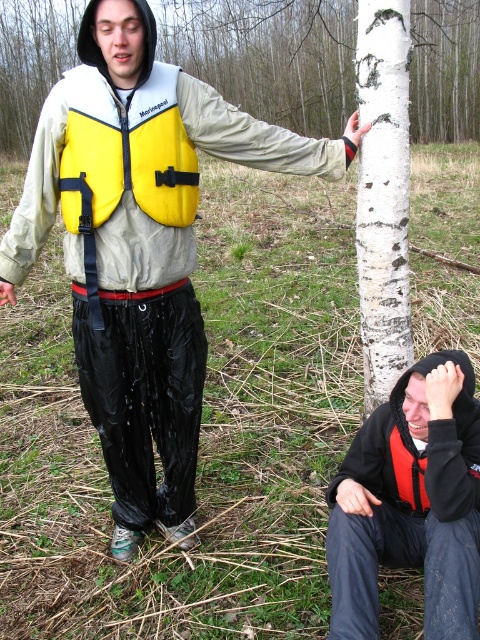
Is point (76, 28) positioned in front of point (384, 396)?

No.

What do you see at coordinates (268, 54) in the screenshot? I see `white smooth tree at center` at bounding box center [268, 54].

Measure the distance between point [440,49] and camera.

Point [440,49] is 29.47 meters from camera.

At what (x,y) coordinates should I click in order to perform the action: click on white smooth tree at center. Please return your answer as a coordinate pair (x, y). The image size is (480, 640). Looking at the image, I should click on (268, 54).

Based on the photo, does white bark tree at center appear over yellow matte life jacket at center?

No.

Does white bark tree at center have a lesser height compared to yellow matte life jacket at center?

In fact, white bark tree at center may be taller than yellow matte life jacket at center.

At what (x,y) coordinates should I click in order to perform the action: click on white bark tree at center. Please return your answer as a coordinate pair (x, y). The height and width of the screenshot is (640, 480). Looking at the image, I should click on (383, 195).

Does yellow neoprene life vest at upper center have a lesser width compared to black matte jacket at lower right?

In fact, yellow neoprene life vest at upper center might be wider than black matte jacket at lower right.

Between point (175, 157) and point (342, 509), which one is positioned in front?

Positioned in front is point (342, 509).

Is point (265, 145) more distant than point (400, 528)?

That is True.

Locate an element on the screen. This screenshot has width=480, height=640. yellow neoprene life vest at upper center is located at coordinates (140, 246).